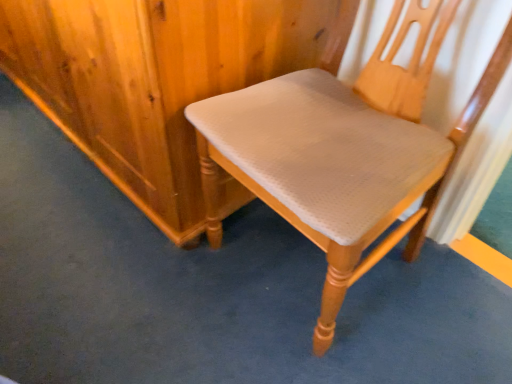
At what (x,y) coordinates should I click in order to perform the action: click on free space to the left of light brown wood chair at center. Please return your answer as a coordinate pair (x, y). The image size is (512, 384). Looking at the image, I should click on (141, 282).